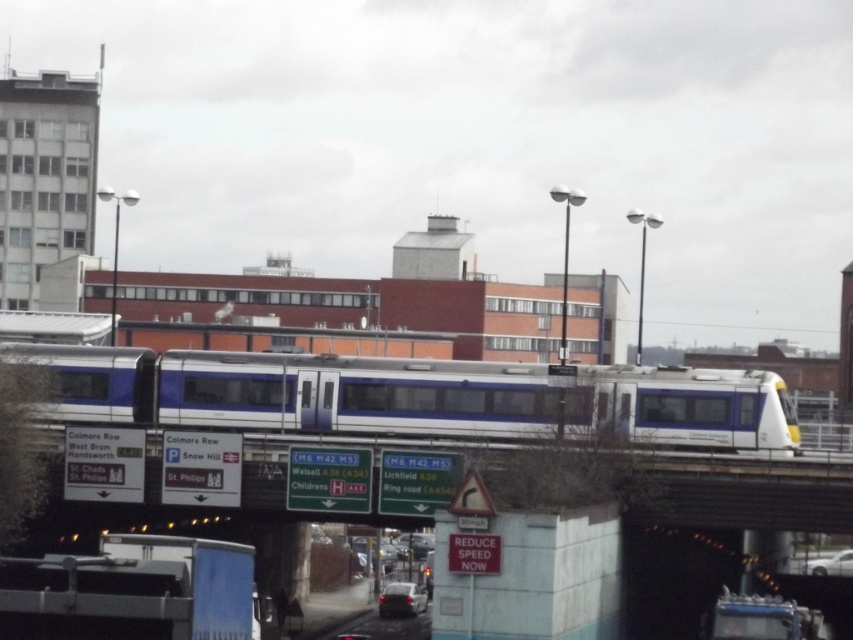
You are a pedestrian standing at the intersection looking at the white plastic signboard at upper center and the white glossy car at lower right. Which object appears taller from your perspective?

The white plastic signboard at upper center is taller than the white glossy car at lower right.

You are a pedestrian standing at the intersection and see the white glossy train at center and the white glossy car at lower right. Which one is more to the left?

The white glossy train at center is more to the left than the white glossy car at lower right.